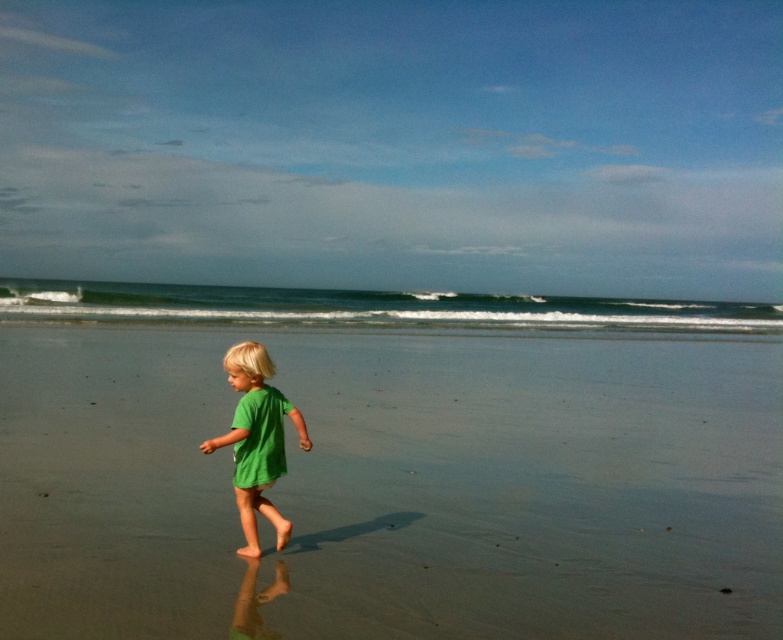
Question: Is blue-green water at center to the left of green matte shirt at center from the viewer's perspective?

Choices:
 (A) no
 (B) yes

Answer: (B)

Question: Can you confirm if smooth sand at center is positioned above blue-green water at center?

Choices:
 (A) no
 (B) yes

Answer: (A)

Question: Does smooth sand at center appear under green matte shirt at center?

Choices:
 (A) no
 (B) yes

Answer: (A)

Question: Which of the following is the closest to the observer?

Choices:
 (A) green matte shirt at center
 (B) smooth sand at center
 (C) blue-green water at center

Answer: (B)

Question: Which is farther from the blue-green water at center?

Choices:
 (A) smooth sand at center
 (B) green matte shirt at center

Answer: (B)

Question: Which point is closer to the camera taking this photo?

Choices:
 (A) (500, 600)
 (B) (354, 300)
 (C) (258, 493)

Answer: (A)